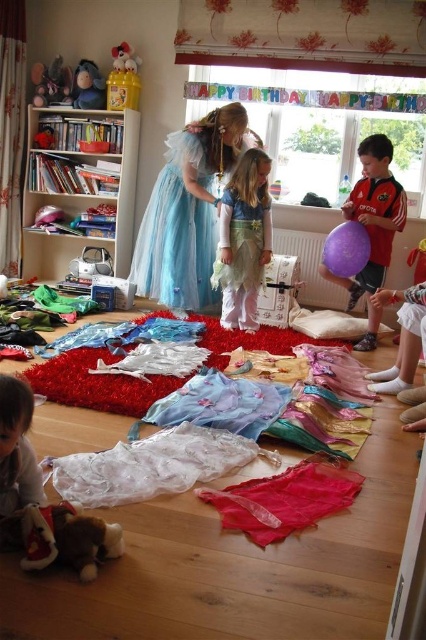
Which is behind, point (20, 496) or point (37, 132)?

Positioned behind is point (37, 132).

Measure the distance between soft beige fabric at lower left and matte plastic toy at upper left.

soft beige fabric at lower left is 3.82 meters away from matte plastic toy at upper left.

Image resolution: width=426 pixels, height=640 pixels. What do you see at coordinates (17, 449) in the screenshot?
I see `soft beige fabric at lower left` at bounding box center [17, 449].

Identify the location of soft beige fabric at lower left. The image size is (426, 640). (17, 449).

Does blue tulle dress at center have a greater width compared to soft beige fabric at lower left?

Correct, the width of blue tulle dress at center exceeds that of soft beige fabric at lower left.

Locate an element on the screen. Image resolution: width=426 pixels, height=640 pixels. blue tulle dress at center is located at coordinates point(178,230).

Does white sheer dress at center have a lesser height compared to white plush toy at upper left?

Yes, white sheer dress at center is shorter than white plush toy at upper left.

The height and width of the screenshot is (640, 426). What do you see at coordinates (154, 465) in the screenshot?
I see `white sheer dress at center` at bounding box center [154, 465].

Locate an element on the screen. Image resolution: width=426 pixels, height=640 pixels. white sheer dress at center is located at coordinates (154, 465).